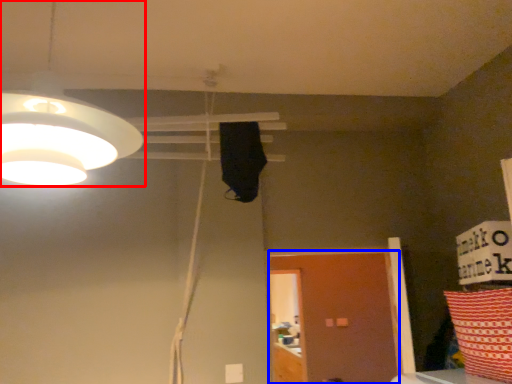
Question: Which object appears closest to the camera in this image, lamp (highlighted by a red box) or door (highlighted by a blue box)?

Choices:
 (A) lamp
 (B) door

Answer: (A)